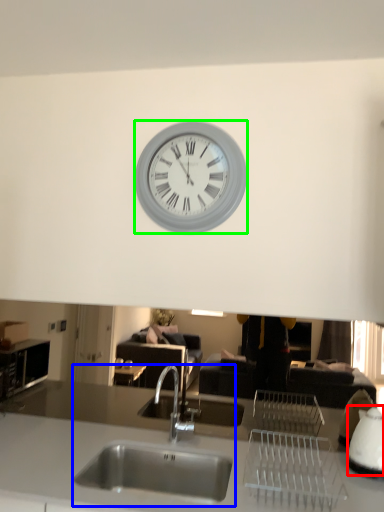
Question: Estimate the real-world distances between objects in this image. Which object is farther from appliance (highlighted by a red box), sink (highlighted by a blue box) or wall clock (highlighted by a green box)?

Choices:
 (A) sink
 (B) wall clock

Answer: (B)